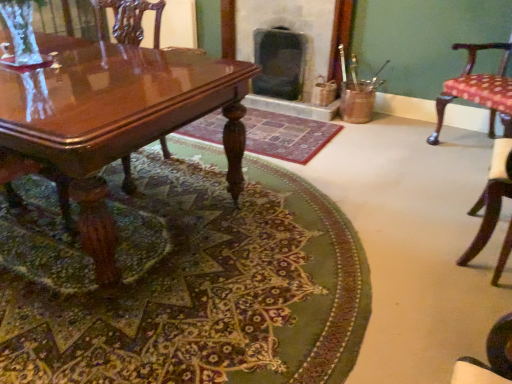
Question: Does dark gray stone fireplace at center, the second fireplace from the left, have a greater height compared to patterned fabric cushion at right, which appears as the 2th chair when viewed from the left?

Choices:
 (A) no
 (B) yes

Answer: (A)

Question: Does dark gray stone fireplace at center, the second fireplace from the left, contain patterned fabric cushion at right, which is the 2th chair from right to left?

Choices:
 (A) yes
 (B) no

Answer: (B)

Question: Considering the relative sizes of dark gray stone fireplace at center, the second fireplace from the left, and patterned fabric cushion at right, which appears as the 2th chair when viewed from the left, in the image provided, is dark gray stone fireplace at center, the second fireplace from the left, shorter than patterned fabric cushion at right, which appears as the 2th chair when viewed from the left,?

Choices:
 (A) no
 (B) yes

Answer: (B)

Question: Can you confirm if dark gray stone fireplace at center, the first fireplace viewed from the right, is wider than patterned fabric cushion at right, which appears as the 2th chair when viewed from the left?

Choices:
 (A) yes
 (B) no

Answer: (A)

Question: Is dark gray stone fireplace at center, the first fireplace viewed from the right, at the left side of patterned fabric cushion at right, which appears as the 2th chair when viewed from the left?

Choices:
 (A) yes
 (B) no

Answer: (A)

Question: Considering the relative positions of carpeted floor at center, placed as the 2th mat when sorted from back to front, and dark gray stone fireplace at center, the second fireplace from the left, in the image provided, is carpeted floor at center, placed as the 2th mat when sorted from back to front, to the left or to the right of dark gray stone fireplace at center, the second fireplace from the left,?

Choices:
 (A) left
 (B) right

Answer: (A)

Question: From the image's perspective, is carpeted floor at center, placed as the 2th mat when sorted from back to front, located above or below dark gray stone fireplace at center, the second fireplace from the left?

Choices:
 (A) below
 (B) above

Answer: (A)

Question: Is carpeted floor at center, placed as the 2th mat when sorted from back to front, wider or thinner than dark gray stone fireplace at center, the second fireplace from the left?

Choices:
 (A) wide
 (B) thin

Answer: (A)

Question: Would you say carpeted floor at center, placed as the 2th mat when sorted from back to front, is inside or outside dark gray stone fireplace at center, the second fireplace from the left?

Choices:
 (A) inside
 (B) outside

Answer: (B)

Question: Relative to glossy wood coffee table at lower left, is patterned fabric cushion at right, which appears as the 2th chair when viewed from the left, in front or behind?

Choices:
 (A) front
 (B) behind

Answer: (B)

Question: From a real-world perspective, is patterned fabric cushion at right, which appears as the 2th chair when viewed from the left, physically located above or below glossy wood coffee table at lower left?

Choices:
 (A) above
 (B) below

Answer: (A)

Question: Considering the positions of point pyautogui.click(x=480, y=243) and point pyautogui.click(x=27, y=94), is point pyautogui.click(x=480, y=243) closer or farther from the camera than point pyautogui.click(x=27, y=94)?

Choices:
 (A) farther
 (B) closer

Answer: (A)

Question: From the image's perspective, relative to glossy wood coffee table at lower left, is patterned fabric cushion at right, which is the 2th chair from right to left, above or below?

Choices:
 (A) below
 (B) above

Answer: (A)

Question: In terms of size, does polka dot fabric chair at right, the first chair positioned from the right, appear bigger or smaller than glossy wood chair at left, the third chair from the right?

Choices:
 (A) small
 (B) big

Answer: (B)

Question: Would you say polka dot fabric chair at right, the first chair positioned from the right, is inside or outside glossy wood chair at left, placed as the first chair when sorted from left to right?

Choices:
 (A) outside
 (B) inside

Answer: (A)